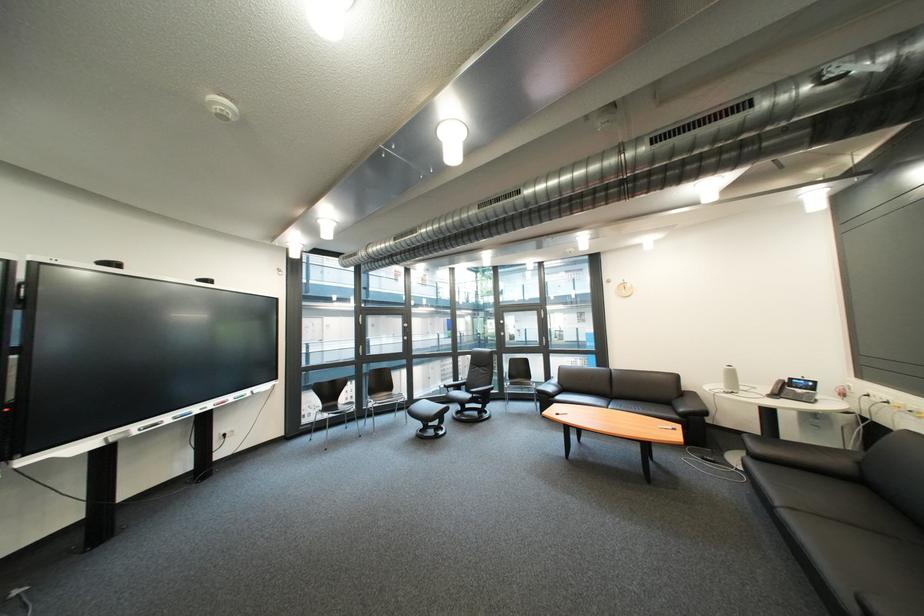
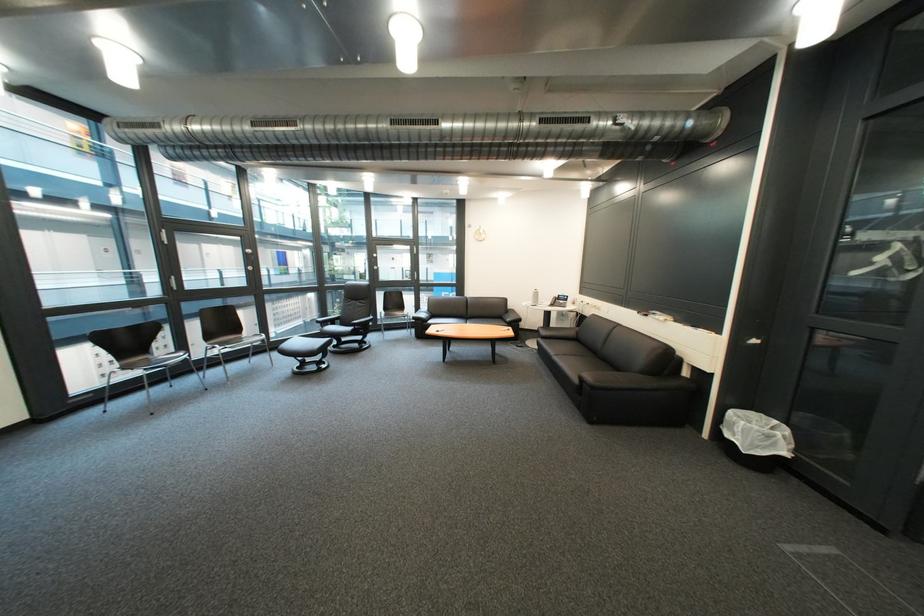
In the second image, find the point that corresponds to [334,410] in the first image.

(131, 368)